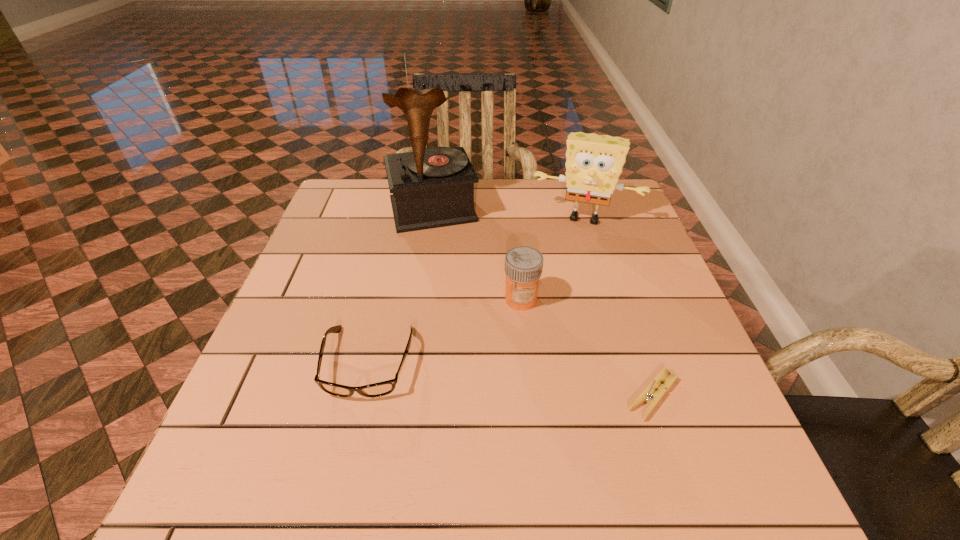
Find the location of a particular element. The height and width of the screenshot is (540, 960). clothespin that is at the near edge is located at coordinates (650, 395).

Find the location of a particular element. object that is positioned at the left edge is located at coordinates (379, 389).

This screenshot has height=540, width=960. Find the location of `clothespin that is at the right edge`. clothespin that is at the right edge is located at coordinates (650, 395).

Locate an element on the screen. The height and width of the screenshot is (540, 960). sponge at the right edge is located at coordinates (594, 163).

I want to click on object located at the near left corner, so click(379, 389).

This screenshot has width=960, height=540. Identify the location of object that is at the far right corner. (594, 163).

Where is `object present at the near right corner`? Image resolution: width=960 pixels, height=540 pixels. object present at the near right corner is located at coordinates (650, 395).

In the image, there is a desktop. Where is `vacant region at the far edge`? vacant region at the far edge is located at coordinates (557, 186).

Find the location of a particular element. free space at the left edge of the desktop is located at coordinates (341, 231).

Image resolution: width=960 pixels, height=540 pixels. I want to click on vacant area at the right edge of the desktop, so click(624, 280).